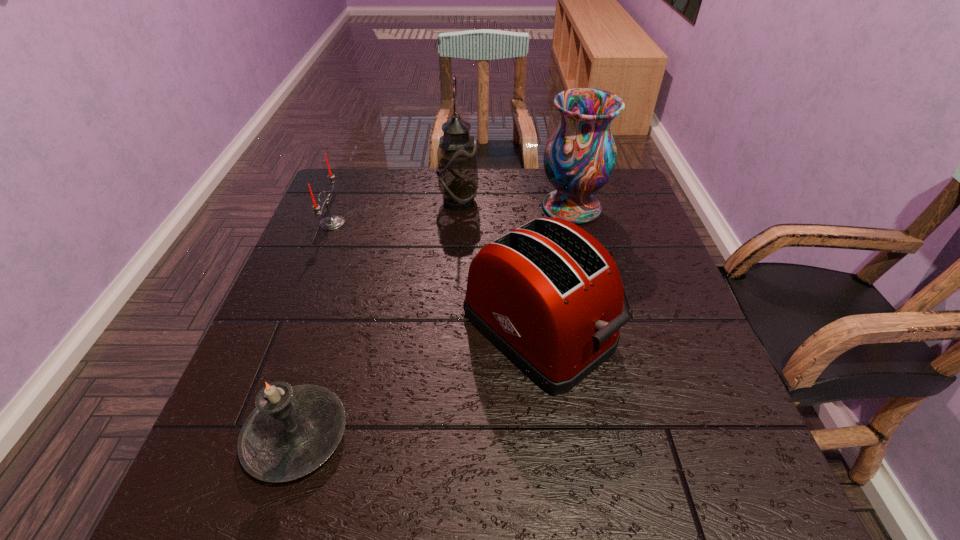
The image size is (960, 540). Identify the location of vacant position in the image that satisfies the following two spatial constraints: 1. on the back side of the nearer candle; 2. on the left side of the oil lamp. (371, 202).